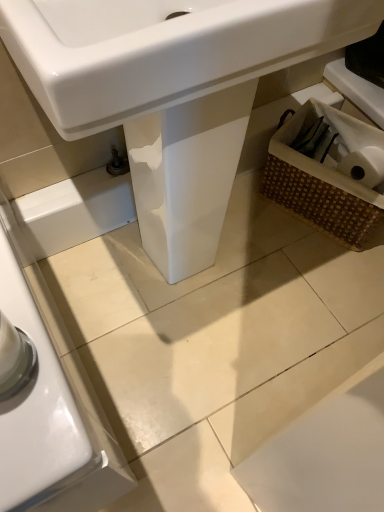
Question: Does white glossy sink at center have a lesser height compared to woven brown basket at lower right?

Choices:
 (A) yes
 (B) no

Answer: (B)

Question: From a real-world perspective, does white glossy sink at center sit lower than woven brown basket at lower right?

Choices:
 (A) no
 (B) yes

Answer: (A)

Question: Is white glossy sink at center positioned with its back to woven brown basket at lower right?

Choices:
 (A) no
 (B) yes

Answer: (A)

Question: Is white glossy sink at center closer to camera compared to woven brown basket at lower right?

Choices:
 (A) yes
 (B) no

Answer: (A)

Question: Considering the relative positions of white glossy sink at center and woven brown basket at lower right in the image provided, is white glossy sink at center behind woven brown basket at lower right?

Choices:
 (A) no
 (B) yes

Answer: (A)

Question: Considering the relative positions of white glossy sink at center and woven brown basket at lower right in the image provided, is white glossy sink at center to the left of woven brown basket at lower right from the viewer's perspective?

Choices:
 (A) yes
 (B) no

Answer: (A)

Question: Can you confirm if woven brown basket at lower right is smaller than woven brown basket at lower right?

Choices:
 (A) no
 (B) yes

Answer: (A)

Question: Can you confirm if woven brown basket at lower right is shorter than woven brown basket at lower right?

Choices:
 (A) no
 (B) yes

Answer: (A)

Question: Is woven brown basket at lower right directly adjacent to woven brown basket at lower right?

Choices:
 (A) yes
 (B) no

Answer: (A)

Question: Is woven brown basket at lower right taller than woven brown basket at lower right?

Choices:
 (A) no
 (B) yes

Answer: (B)

Question: Does woven brown basket at lower right turn towards woven brown basket at lower right?

Choices:
 (A) no
 (B) yes

Answer: (B)

Question: From the image's perspective, is woven brown basket at lower right beneath woven brown basket at lower right?

Choices:
 (A) yes
 (B) no

Answer: (A)

Question: Is white glossy sink at center not near woven brown basket at lower right?

Choices:
 (A) no
 (B) yes

Answer: (A)